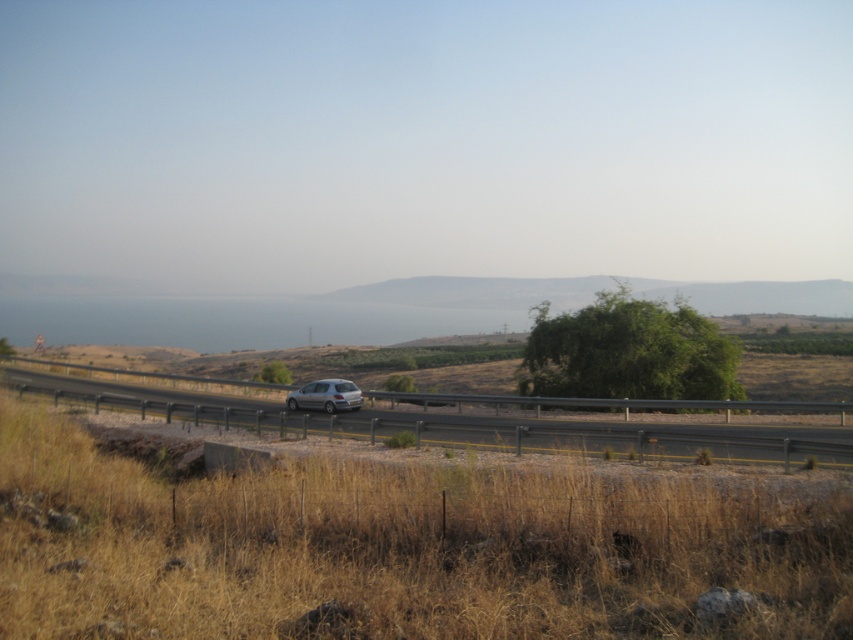
From the picture: Can you confirm if dry grass at center is positioned to the right of satin silver hatchback at center?

Indeed, dry grass at center is positioned on the right side of satin silver hatchback at center.

Does point (51, 531) come in front of point (340, 401)?

Yes.

Image resolution: width=853 pixels, height=640 pixels. What are the coordinates of `dry grass at center` in the screenshot? It's located at (402, 548).

Identify the location of dry grass at center. The height and width of the screenshot is (640, 853). [402, 548].

Who is positioned more to the left, metallic gray highway at center or satin silver hatchback at center?

metallic gray highway at center is more to the left.

Does metallic gray highway at center have a lesser width compared to satin silver hatchback at center?

No.

Which is behind, point (368, 429) or point (338, 381)?

Point (338, 381)

What are the coordinates of `metallic gray highway at center` in the screenshot? It's located at (451, 424).

In the scene shown: Does dry grass at center have a greater width compared to metallic gray highway at center?

In fact, dry grass at center might be narrower than metallic gray highway at center.

Who is more forward, (161,525) or (523,397)?

Point (161,525)

Which is behind, point (7, 611) or point (682, 433)?

The point (682, 433) is behind.

Where is `dry grass at center`? This screenshot has width=853, height=640. dry grass at center is located at coordinates (402, 548).